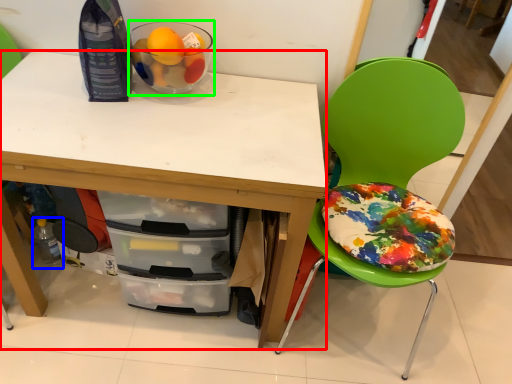
Question: Which object is positioned closest to desk (highlighted by a red box)? Select from bottle (highlighted by a blue box) and glass bowl (highlighted by a green box).

Choices:
 (A) bottle
 (B) glass bowl

Answer: (B)